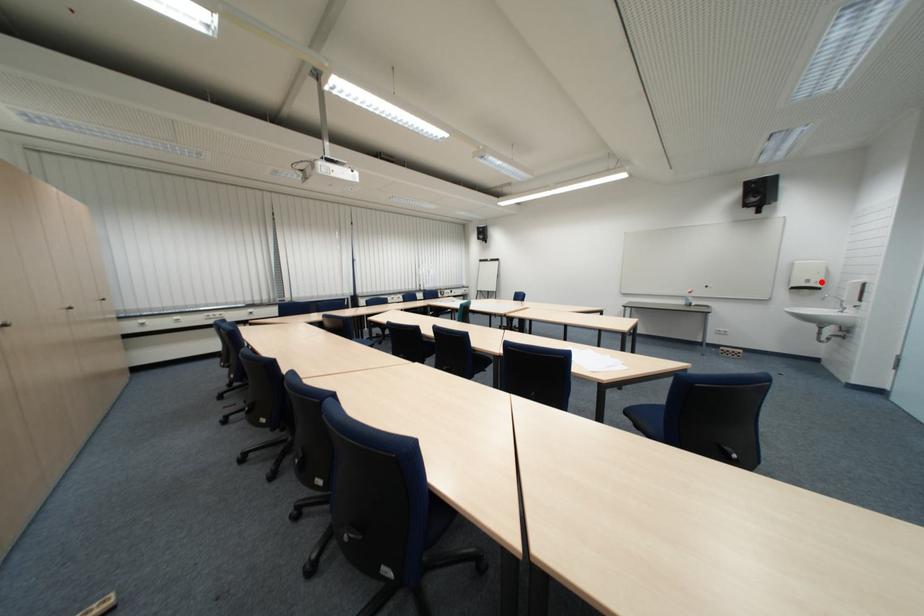
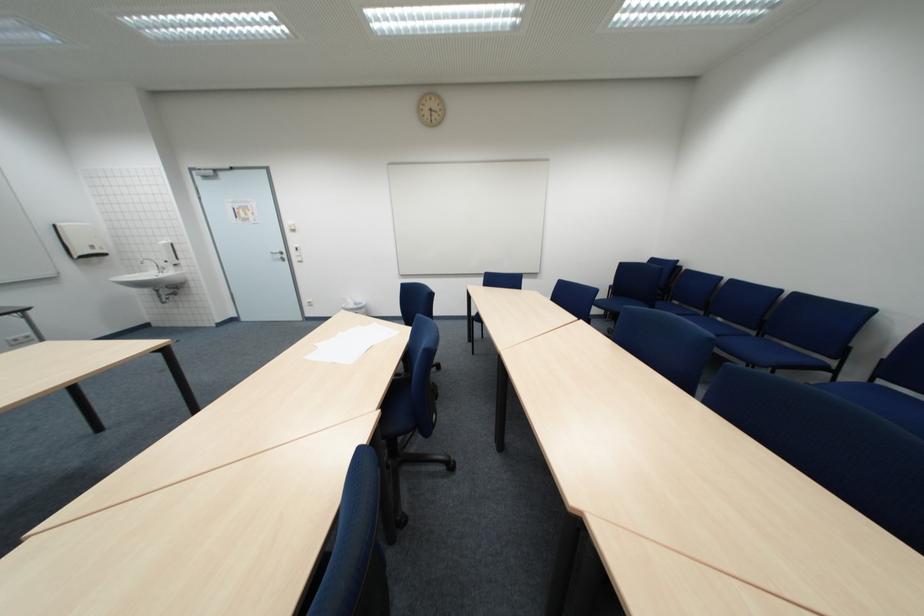
In the second image, find the point that corresponds to the highlighted location in the first image.

(105, 248)